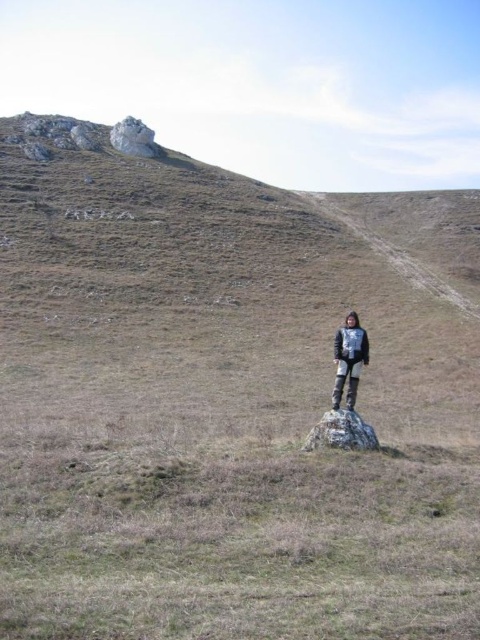
You are a hiker trying to navigate the path. You see a gray fabric jacket at center and a white rocky peak at upper left. Which object is located to the right of the other?

The gray fabric jacket at center is positioned on the right side of white rocky peak at upper left.

You are a hiker standing on the gray rough rock at center. You want to climb the white rocky peak at upper left. Which direction should you head towards?

The white rocky peak at upper left is located at the upper left direction from the gray rough rock at center, so you should head towards the upper left direction to climb it.

You are an outdoor photographer planning to capture the landscape with both the gray fabric jacket at center and the gray rough rock at center in the frame. Which object should you focus on first if you want to ensure both are in sharp focus?

You should focus on the gray fabric jacket at center first because it has a larger size compared to the gray rough rock at center, allowing for a greater depth of field to include both in focus.